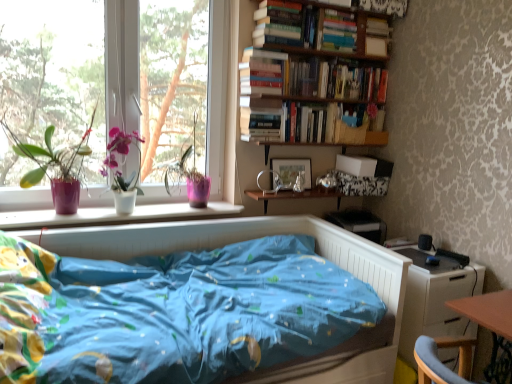
Question: Is transparent glass window at upper left shorter than hardcover book at upper right, which appears as the 2th book when viewed from the top?

Choices:
 (A) no
 (B) yes

Answer: (A)

Question: Does transparent glass window at upper left come behind hardcover book at upper right, which appears as the 2th book when viewed from the top?

Choices:
 (A) yes
 (B) no

Answer: (B)

Question: Considering the relative sizes of transparent glass window at upper left and hardcover book at upper right, which appears as the 2th book when viewed from the top, in the image provided, is transparent glass window at upper left thinner than hardcover book at upper right, which appears as the 2th book when viewed from the top,?

Choices:
 (A) no
 (B) yes

Answer: (A)

Question: Can you confirm if transparent glass window at upper left is smaller than hardcover book at upper right, which is the 2th book in bottom-to-top order?

Choices:
 (A) yes
 (B) no

Answer: (B)

Question: Could you tell me if transparent glass window at upper left is turned towards hardcover book at upper right, which appears as the 2th book when viewed from the top?

Choices:
 (A) no
 (B) yes

Answer: (A)

Question: Considering their positions, is matte wooden picture frame at center located in front of or behind matte purple pot at left?

Choices:
 (A) behind
 (B) front

Answer: (A)

Question: Choose the correct answer: Is matte wooden picture frame at center inside matte purple pot at left or outside it?

Choices:
 (A) inside
 (B) outside

Answer: (B)

Question: From a real-world perspective, is matte wooden picture frame at center above or below matte purple pot at left?

Choices:
 (A) above
 (B) below

Answer: (B)

Question: Considering the positions of point (286, 185) and point (42, 170), is point (286, 185) closer or farther from the camera than point (42, 170)?

Choices:
 (A) farther
 (B) closer

Answer: (A)

Question: From the image's perspective, relative to transparent glass window at upper left, is wooden shelf at center, which is the 2th shelf in top-to-bottom order, above or below?

Choices:
 (A) above
 (B) below

Answer: (B)

Question: Is wooden shelf at center, which is the first shelf in bottom-to-top order, in front of or behind transparent glass window at upper left in the image?

Choices:
 (A) front
 (B) behind

Answer: (B)

Question: Would you say wooden shelf at center, which is the first shelf in bottom-to-top order, is to the left or to the right of transparent glass window at upper left in the picture?

Choices:
 (A) left
 (B) right

Answer: (B)

Question: Is wooden shelf at center, which is the 2th shelf in top-to-bottom order, wider or thinner than transparent glass window at upper left?

Choices:
 (A) thin
 (B) wide

Answer: (B)

Question: Is point (399, 340) positioned closer to the camera than point (282, 173)?

Choices:
 (A) farther
 (B) closer

Answer: (B)

Question: In the image, is white glossy dresser at lower right on the left side or the right side of matte wooden picture frame at center?

Choices:
 (A) right
 (B) left

Answer: (A)